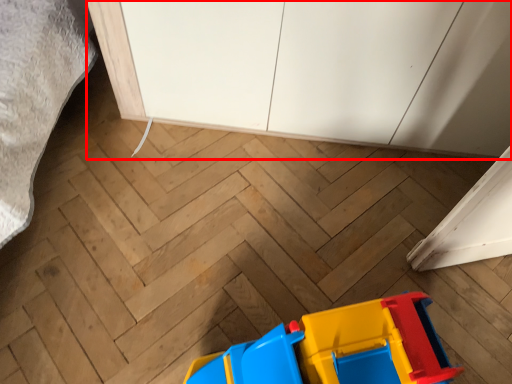
Question: Observing the image, what is the correct spatial positioning of cabinetry (annotated by the red box) in reference to toy?

Choices:
 (A) right
 (B) left

Answer: (A)